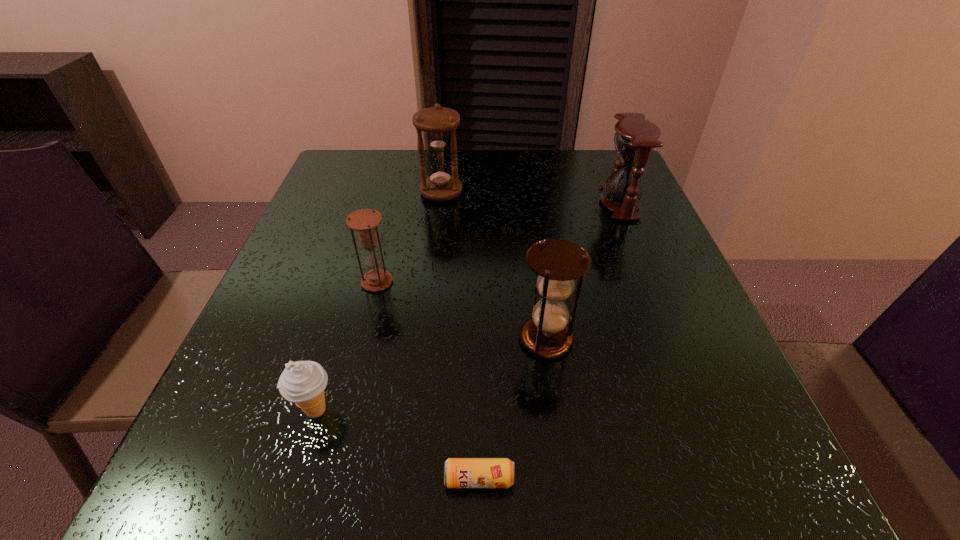
The image size is (960, 540). What are the coordinates of `free space at the far edge` in the screenshot? It's located at tap(557, 180).

This screenshot has height=540, width=960. I want to click on vacant region at the near edge of the desktop, so click(555, 512).

In order to click on vacant space at the left edge of the desktop in this screenshot , I will do `click(271, 285)`.

Where is `vacant space at the right edge`? The image size is (960, 540). vacant space at the right edge is located at coordinates (649, 259).

What are the coordinates of `vacant space at the far left corner of the desktop` in the screenshot? It's located at (331, 172).

The height and width of the screenshot is (540, 960). I want to click on blank space at the near left corner, so click(298, 458).

Image resolution: width=960 pixels, height=540 pixels. In the image, there is a desktop. Identify the location of vacant space at the far right corner. (591, 160).

The height and width of the screenshot is (540, 960). Find the location of `free space between the fifth tallest object and the shortest object`. free space between the fifth tallest object and the shortest object is located at coordinates (397, 444).

Where is `empty space between the second shortest object and the third farthest hourglass`? This screenshot has width=960, height=540. empty space between the second shortest object and the third farthest hourglass is located at coordinates (347, 346).

This screenshot has height=540, width=960. In order to click on free area in between the third shortest object and the second shortest object in this screenshot , I will do `click(347, 346)`.